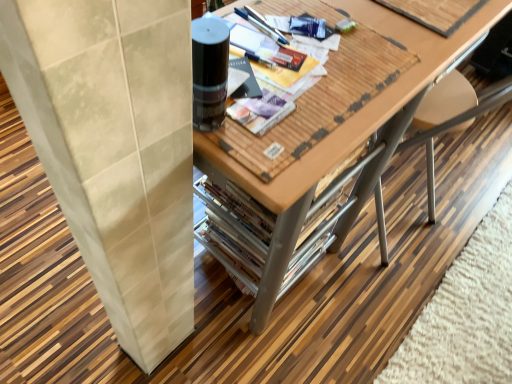
This screenshot has height=384, width=512. Describe the element at coordinates (265, 48) in the screenshot. I see `matte black magazine at center, arranged as the second magazine when viewed from the top` at that location.

I want to click on wooden table at center, so click(348, 131).

Is wooden magazine at upper right, the 2th magazine from the bottom, at the left side of wooden table at center?

Incorrect, wooden magazine at upper right, the 2th magazine from the bottom, is not on the left side of wooden table at center.

Which object is more forward, wooden magazine at upper right, positioned as the 2th magazine in front-to-back order, or wooden table at center?

wooden table at center is more forward.

How distant is wooden magazine at upper right, the second magazine when ordered from left to right, from wooden table at center?

wooden magazine at upper right, the second magazine when ordered from left to right, is 10.74 inches from wooden table at center.

Which is closer, (238,41) or (458,16)?

Point (238,41)

Is matte black magazine at center, the first magazine from the front, not near wooden magazine at upper right, placed as the 1th magazine when sorted from top to bottom?

No, matte black magazine at center, the first magazine from the front, is not far away from wooden magazine at upper right, placed as the 1th magazine when sorted from top to bottom.

Is wooden magazine at upper right, positioned as the 2th magazine in front-to-back order, at the back of matte black magazine at center, arranged as the second magazine when viewed from the top?

matte black magazine at center, arranged as the second magazine when viewed from the top, is not turned away from wooden magazine at upper right, positioned as the 2th magazine in front-to-back order.

How different are the orientations of matte black magazine at center, which ranks as the 1th magazine in left-to-right order, and wooden magazine at upper right, the 2th magazine from the bottom, in degrees?

The angular difference between matte black magazine at center, which ranks as the 1th magazine in left-to-right order, and wooden magazine at upper right, the 2th magazine from the bottom, is 3.4 degrees.

Which of these two, wooden table at center or wooden magazine at upper right, placed as the 1th magazine when sorted from top to bottom, is bigger?

wooden table at center is bigger.

Is wooden table at center positioned in front of wooden magazine at upper right, positioned as the 2th magazine in front-to-back order?

Yes.

Is wooden table at center directly adjacent to wooden magazine at upper right, positioned as the 2th magazine in front-to-back order?

No, wooden table at center is not next to wooden magazine at upper right, positioned as the 2th magazine in front-to-back order.

From a real-world perspective, is wooden table at center located beneath matte black magazine at center, which ranks as the 1th magazine in left-to-right order?

Correct, in the physical world, wooden table at center is lower than matte black magazine at center, which ranks as the 1th magazine in left-to-right order.

Can you tell me how much wooden table at center and matte black magazine at center, which ranks as the 1th magazine in left-to-right order, differ in facing direction?

There is a 1.65-degree angle between the facing directions of wooden table at center and matte black magazine at center, which ranks as the 1th magazine in left-to-right order.

How distant is wooden table at center from matte black magazine at center, arranged as the second magazine when viewed from the top?

The distance of wooden table at center from matte black magazine at center, arranged as the second magazine when viewed from the top, is 13.24 inches.

From the image's perspective, which one is positioned higher, wooden table at center or matte black magazine at center, which ranks as the 2th magazine in back-to-front order?

matte black magazine at center, which ranks as the 2th magazine in back-to-front order, appears higher in the image.

From the picture: Considering the relative positions of wooden magazine at upper right, the 2th magazine from the bottom, and matte black magazine at center, the 2th magazine positioned from the right, in the image provided, is wooden magazine at upper right, the 2th magazine from the bottom, to the right of matte black magazine at center, the 2th magazine positioned from the right, from the viewer's perspective?

Yes, wooden magazine at upper right, the 2th magazine from the bottom, is to the right of matte black magazine at center, the 2th magazine positioned from the right.

Considering the sizes of objects wooden magazine at upper right, the 2th magazine from the bottom, and matte black magazine at center, marked as the first magazine in a bottom-to-top arrangement, in the image provided, who is taller, wooden magazine at upper right, the 2th magazine from the bottom, or matte black magazine at center, marked as the first magazine in a bottom-to-top arrangement,?

wooden magazine at upper right, the 2th magazine from the bottom, is taller.

From the image's perspective, between wooden magazine at upper right, the second magazine when ordered from left to right, and matte black magazine at center, marked as the first magazine in a bottom-to-top arrangement, which one is located above?

wooden magazine at upper right, the second magazine when ordered from left to right, from the image's perspective.

Does matte black magazine at center, marked as the first magazine in a bottom-to-top arrangement, have a greater height compared to wooden table at center?

No.

Is matte black magazine at center, which ranks as the 2th magazine in back-to-front order, positioned with its back to wooden table at center?

matte black magazine at center, which ranks as the 2th magazine in back-to-front order, is not turned away from wooden table at center.

From the image's perspective, does matte black magazine at center, which ranks as the 1th magazine in left-to-right order, appear higher than wooden table at center?

Correct, matte black magazine at center, which ranks as the 1th magazine in left-to-right order, appears higher than wooden table at center in the image.

In terms of size, does matte black magazine at center, which ranks as the 1th magazine in left-to-right order, appear bigger or smaller than wooden table at center?

Considering their sizes, matte black magazine at center, which ranks as the 1th magazine in left-to-right order, takes up less space than wooden table at center.

Locate an element on the screen. The height and width of the screenshot is (384, 512). the 1st magazine positioned above the wooden table at center (from a real-world perspective) is located at coordinates pyautogui.click(x=436, y=12).

Where is `magazine above the matte black magazine at center, which ranks as the 2th magazine in back-to-front order (from the image's perspective)`? magazine above the matte black magazine at center, which ranks as the 2th magazine in back-to-front order (from the image's perspective) is located at coordinates (436, 12).

Based on their spatial positions, is wooden table at center or wooden magazine at upper right, the 2th magazine from the bottom, closer to matte black magazine at center, marked as the first magazine in a bottom-to-top arrangement?

Based on the image, wooden table at center appears to be nearer to matte black magazine at center, marked as the first magazine in a bottom-to-top arrangement.

Considering their positions, is matte black magazine at center, the first magazine from the front, positioned further to wooden table at center than wooden magazine at upper right, placed as the 1th magazine when sorted from top to bottom?

The object further to wooden table at center is matte black magazine at center, the first magazine from the front.

Looking at the image, which one is located closer to wooden magazine at upper right, placed as the 1th magazine when sorted from top to bottom, matte black magazine at center, which ranks as the 1th magazine in left-to-right order, or wooden table at center?

wooden table at center is positioned closer to the anchor wooden magazine at upper right, placed as the 1th magazine when sorted from top to bottom.

Consider the image. Estimate the real-world distances between objects in this image. Which object is closer to wooden table at center, wooden magazine at upper right, the second magazine when ordered from left to right, or matte black magazine at center, which ranks as the 2th magazine in back-to-front order?

wooden magazine at upper right, the second magazine when ordered from left to right.

Which object lies nearer to the anchor point wooden magazine at upper right, which is counted as the first magazine, starting from the right, wooden table at center or matte black magazine at center, the first magazine from the front?

Among the two, wooden table at center is located nearer to wooden magazine at upper right, which is counted as the first magazine, starting from the right.

Based on their spatial positions, is wooden magazine at upper right, placed as the 1th magazine when sorted from top to bottom, or wooden table at center closer to matte black magazine at center, the first magazine from the front?

wooden table at center is positioned closer to the anchor matte black magazine at center, the first magazine from the front.

This screenshot has width=512, height=384. Find the location of `table situated between matte black magazine at center, which ranks as the 2th magazine in back-to-front order, and wooden magazine at upper right, which is counted as the first magazine, starting from the right, from left to right`. table situated between matte black magazine at center, which ranks as the 2th magazine in back-to-front order, and wooden magazine at upper right, which is counted as the first magazine, starting from the right, from left to right is located at coordinates (348, 131).